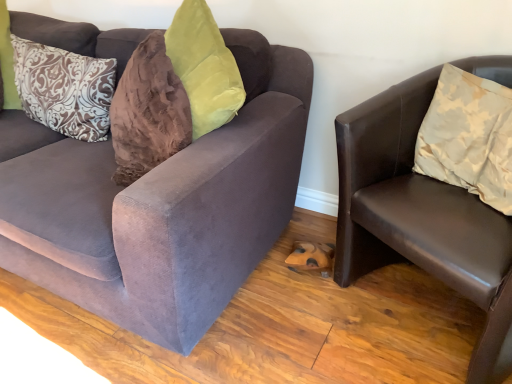
Question: In the image, is brown patterned pillow at left, the 2th pillow viewed from the right, positioned in front of or behind brown leather chair at right, which is the second studio couch from left to right?

Choices:
 (A) front
 (B) behind

Answer: (B)

Question: From the image's perspective, is brown patterned pillow at left, the 2th pillow viewed from the right, positioned above or below brown leather chair at right, the first studio couch viewed from the right?

Choices:
 (A) above
 (B) below

Answer: (A)

Question: Which of these objects is positioned farthest from the brown patterned pillow at left, which ranks as the first pillow in left-to-right order?

Choices:
 (A) brown leather chair at right, which is the second studio couch from left to right
 (B) velvet brown couch at left, the 2th studio couch viewed from the right
 (C) beige satin pillow at right, the 2th pillow when ordered from back to front

Answer: (C)

Question: Based on their relative distances, which object is nearer to the beige satin pillow at right, marked as the second pillow in a left-to-right arrangement?

Choices:
 (A) brown patterned pillow at left, which ranks as the 2th pillow in front-to-back order
 (B) brown leather chair at right, the first studio couch viewed from the right
 (C) velvet brown couch at left, arranged as the 1th studio couch when viewed from the left

Answer: (B)